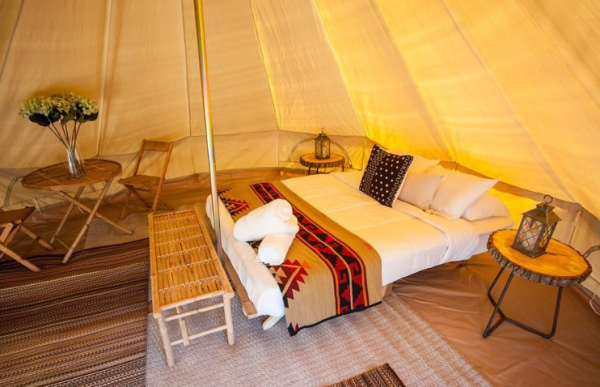
At what (x,y) coordinates should I click in order to perform the action: click on pillows. Please return your answer as a coordinate pair (x, y). Looking at the image, I should click on (463, 196), (428, 191), (423, 160), (382, 180).